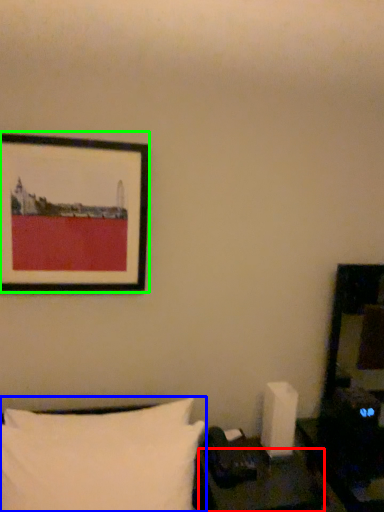
Question: Considering the real-world distances, which object is closest to table (highlighted by a red box)? pillow (highlighted by a blue box) or picture frame (highlighted by a green box).

Choices:
 (A) pillow
 (B) picture frame

Answer: (A)